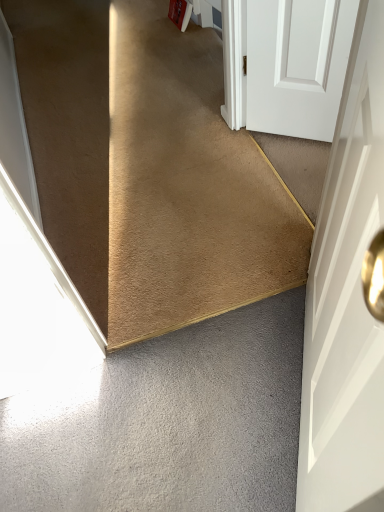
What do you see at coordinates (168, 423) in the screenshot? This screenshot has width=384, height=512. I see `gray matte concrete at lower left` at bounding box center [168, 423].

This screenshot has height=512, width=384. Identify the location of carpet at center. (148, 168).

Is carpet at center oriented away from gray matte concrete at lower left?

No, carpet at center's orientation is not away from gray matte concrete at lower left.

The image size is (384, 512). Identify the location of concrete lying in front of the carpet at center. (168, 423).

Between carpet at center and gray matte concrete at lower left, which one has smaller width?

With smaller width is gray matte concrete at lower left.

From the image's perspective, is gray matte concrete at lower left located beneath carpet at center?

Correct, gray matte concrete at lower left appears lower than carpet at center in the image.

From a real-world perspective, is gray matte concrete at lower left on top of carpet at center?

Yes, from a real-world perspective, gray matte concrete at lower left is on top of carpet at center.

In terms of width, does gray matte concrete at lower left look wider or thinner when compared to carpet at center?

gray matte concrete at lower left is thinner than carpet at center.

Is the depth of gray matte concrete at lower left less than that of white matte door at right?

No, it is behind white matte door at right.

Based on the photo, considering the sizes of objects gray matte concrete at lower left and white matte door at right in the image provided, who is smaller, gray matte concrete at lower left or white matte door at right?

gray matte concrete at lower left.

Considering the relative sizes of gray matte concrete at lower left and white matte door at right in the image provided, is gray matte concrete at lower left taller than white matte door at right?

No, gray matte concrete at lower left is not taller than white matte door at right.

Based on the photo, from a real-world perspective, is gray matte concrete at lower left physically above white matte door at right?

No.

Can you tell me how much white matte door at right and gray matte concrete at lower left differ in facing direction?

white matte door at right and gray matte concrete at lower left are facing 59.7 degrees away from each other.

From the image's perspective, does white matte door at right appear lower than gray matte concrete at lower left?

No, from the image's perspective, white matte door at right is not below gray matte concrete at lower left.

Identify the location of door above the gray matte concrete at lower left (from a real-world perspective). The height and width of the screenshot is (512, 384). (346, 298).

Is white matte door at right turned away from gray matte concrete at lower left?

No, gray matte concrete at lower left is not at the back of white matte door at right.

From a real-world perspective, who is located lower, white matte door at right or carpet at center?

carpet at center.

Could carpet at center be considered to be inside white matte door at right?

Definitely not — carpet at center is not inside white matte door at right.

Is white matte door at right positioned before carpet at center?

Yes, white matte door at right is closer to the viewer.

From the image's perspective, is white matte door at right on carpet at center?

No, from the image's perspective, white matte door at right is not on top of carpet at center.

The width and height of the screenshot is (384, 512). I want to click on door lying on the right of carpet at center, so click(x=346, y=298).

Considering the sizes of objects carpet at center and white matte door at right in the image provided, who is thinner, carpet at center or white matte door at right?

With smaller width is white matte door at right.

How much distance is there between carpet at center and white matte door at right?

A distance of 31.92 inches exists between carpet at center and white matte door at right.

How many degrees apart are the facing directions of carpet at center and white matte door at right?

The angle between the facing direction of carpet at center and the facing direction of white matte door at right is 120 degrees.

This screenshot has height=512, width=384. I want to click on concrete in front of the carpet at center, so click(x=168, y=423).

In order to click on concrete above the carpet at center (from a real-world perspective) in this screenshot , I will do `click(168, 423)`.

From the picture: Looking at the image, which one is located closer to carpet at center, gray matte concrete at lower left or white matte door at right?

Among the two, gray matte concrete at lower left is located nearer to carpet at center.

Estimate the real-world distances between objects in this image. Which object is closer to gray matte concrete at lower left, carpet at center or white matte door at right?

white matte door at right is positioned closer to the anchor gray matte concrete at lower left.

Looking at the image, which one is located closer to white matte door at right, gray matte concrete at lower left or carpet at center?

gray matte concrete at lower left is closer to white matte door at right.

Estimate the real-world distances between objects in this image. Which object is further from white matte door at right, carpet at center or gray matte concrete at lower left?

carpet at center.

Looking at the image, which one is located closer to gray matte concrete at lower left, white matte door at right or carpet at center?

white matte door at right.

Looking at the image, which one is located closer to carpet at center, white matte door at right or gray matte concrete at lower left?

Based on the image, gray matte concrete at lower left appears to be nearer to carpet at center.

Locate an element on the screen. door between carpet at center and gray matte concrete at lower left vertically is located at coordinates (346, 298).